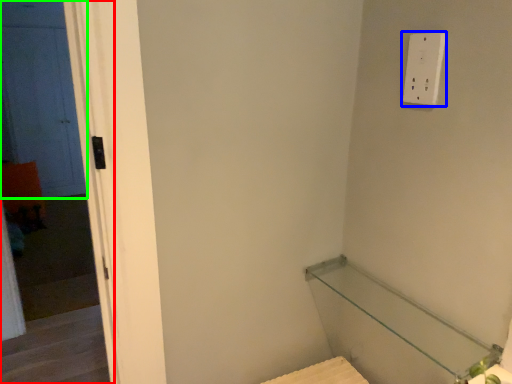
Question: Based on their relative distances, which object is farther from screen door (highlighted by a red box)? Choose from light switch (highlighted by a blue box) and door (highlighted by a green box).

Choices:
 (A) light switch
 (B) door

Answer: (A)